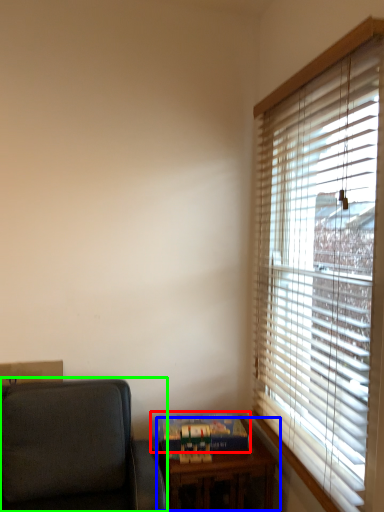
Question: Which object is the closest to the paperback book (highlighted by a red box)? Choose among these: table (highlighted by a blue box) or studio couch (highlighted by a green box).

Choices:
 (A) table
 (B) studio couch

Answer: (A)